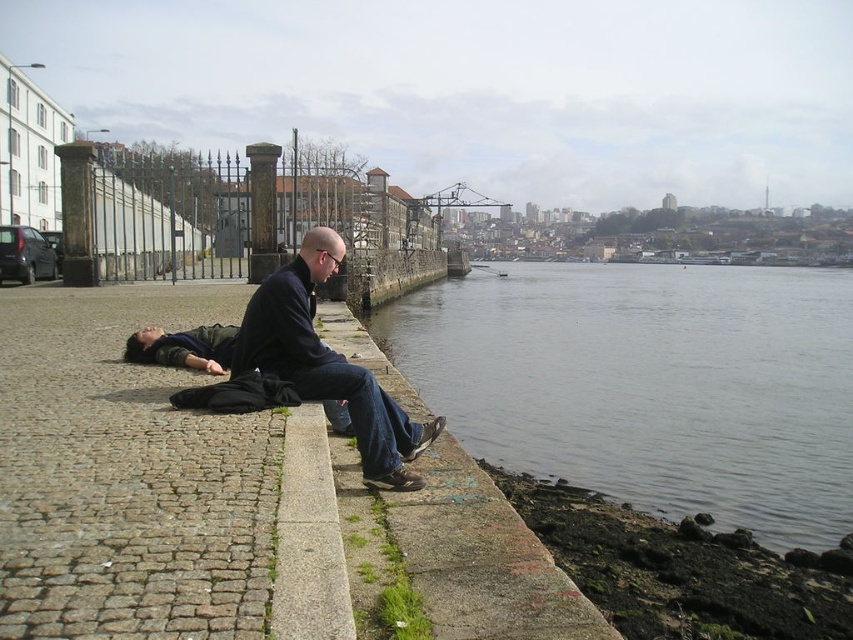
You are a maintenance worker inspecting the riverside area. You notice the gray concrete waterway at lower center and the gray concrete curb at lower center. Which one is positioned higher in elevation?

The gray concrete waterway at lower center is positioned higher in elevation than the gray concrete curb at lower center because it is above it.

You are a delivery person trying to navigate a narrow pathway between the gray concrete waterway at lower center and the gray concrete curb at lower center. Can you pass through this space if your delivery cart is 1.2 meters wide?

The gray concrete waterway at lower center might be wider than gray concrete curb at lower center, so it is uncertain if the delivery cart can pass through. Check the actual width before proceeding.

You are standing at the cobblestone pathway leading towards the riverbank and see two points marked in the scene. Which point, point [259,285] or point [289,588], is closer to you?

Point [259,285] is closer to you than point [289,588] because it is further to the viewer.